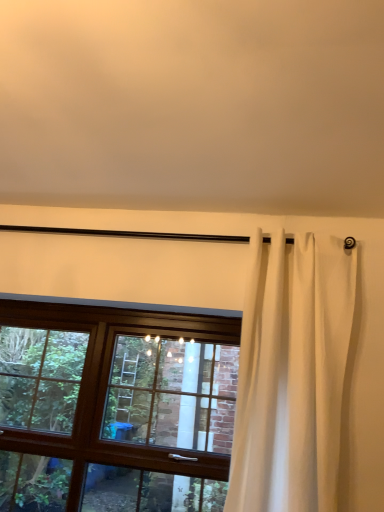
Question: Visually, is white sheer curtain at right positioned to the left or to the right of brown wooden window at center?

Choices:
 (A) left
 (B) right

Answer: (B)

Question: Considering the positions of point (246, 352) and point (196, 348), is point (246, 352) closer or farther from the camera than point (196, 348)?

Choices:
 (A) farther
 (B) closer

Answer: (B)

Question: From a real-world perspective, is white sheer curtain at right positioned above or below brown wooden window at center?

Choices:
 (A) below
 (B) above

Answer: (B)

Question: From a real-world perspective, is brown wooden window at center positioned above or below white sheer curtain at right?

Choices:
 (A) above
 (B) below

Answer: (B)

Question: Based on their sizes in the image, would you say brown wooden window at center is bigger or smaller than white sheer curtain at right?

Choices:
 (A) small
 (B) big

Answer: (B)

Question: Looking at their shapes, would you say brown wooden window at center is wider or thinner than white sheer curtain at right?

Choices:
 (A) wide
 (B) thin

Answer: (B)

Question: Considering their positions, is brown wooden window at center located in front of or behind white sheer curtain at right?

Choices:
 (A) front
 (B) behind

Answer: (B)